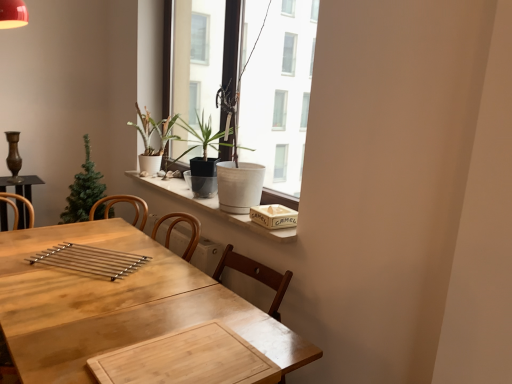
Question: Is wooden textured book at upper right inside polished metal tray at center?

Choices:
 (A) yes
 (B) no

Answer: (B)

Question: Considering the relative sizes of polished metal tray at center and wooden textured book at upper right in the image provided, is polished metal tray at center bigger than wooden textured book at upper right?

Choices:
 (A) no
 (B) yes

Answer: (B)

Question: Considering the relative positions of polished metal tray at center and wooden textured book at upper right in the image provided, is polished metal tray at center to the right of wooden textured book at upper right from the viewer's perspective?

Choices:
 (A) yes
 (B) no

Answer: (B)

Question: Is polished metal tray at center taller than wooden textured book at upper right?

Choices:
 (A) no
 (B) yes

Answer: (A)

Question: Does polished metal tray at center appear on the left side of wooden textured book at upper right?

Choices:
 (A) yes
 (B) no

Answer: (A)

Question: Based on their sizes in the image, would you say white matte pot at upper center is bigger or smaller than polished metal tray at center?

Choices:
 (A) big
 (B) small

Answer: (A)

Question: Considering the positions of white matte pot at upper center and polished metal tray at center in the image, is white matte pot at upper center wider or thinner than polished metal tray at center?

Choices:
 (A) thin
 (B) wide

Answer: (A)

Question: Is white matte pot at upper center spatially inside polished metal tray at center, or outside of it?

Choices:
 (A) inside
 (B) outside

Answer: (B)

Question: From the image's perspective, relative to polished metal tray at center, is white matte pot at upper center above or below?

Choices:
 (A) below
 (B) above

Answer: (B)

Question: Considering their positions, is matte black pot at center, positioned as the first houseplant in right-to-left order, located in front of or behind polished metal tray at center?

Choices:
 (A) behind
 (B) front

Answer: (A)

Question: From the image's perspective, is matte black pot at center, positioned as the first houseplant in right-to-left order, located above or below polished metal tray at center?

Choices:
 (A) above
 (B) below

Answer: (A)

Question: Looking at the image, does matte black pot at center, arranged as the 3th houseplant when viewed from the left, seem bigger or smaller compared to polished metal tray at center?

Choices:
 (A) big
 (B) small

Answer: (A)

Question: Based on their positions, is matte black pot at center, positioned as the first houseplant in right-to-left order, located to the left or right of polished metal tray at center?

Choices:
 (A) right
 (B) left

Answer: (A)

Question: Considering the positions of green matte christmas tree at left, the 3th houseplant in the right-to-left sequence, and white marble window sill at upper center in the image, is green matte christmas tree at left, the 3th houseplant in the right-to-left sequence, bigger or smaller than white marble window sill at upper center?

Choices:
 (A) big
 (B) small

Answer: (A)

Question: From the image's perspective, relative to white marble window sill at upper center, is green matte christmas tree at left, which is counted as the first houseplant, starting from the left, above or below?

Choices:
 (A) above
 (B) below

Answer: (A)